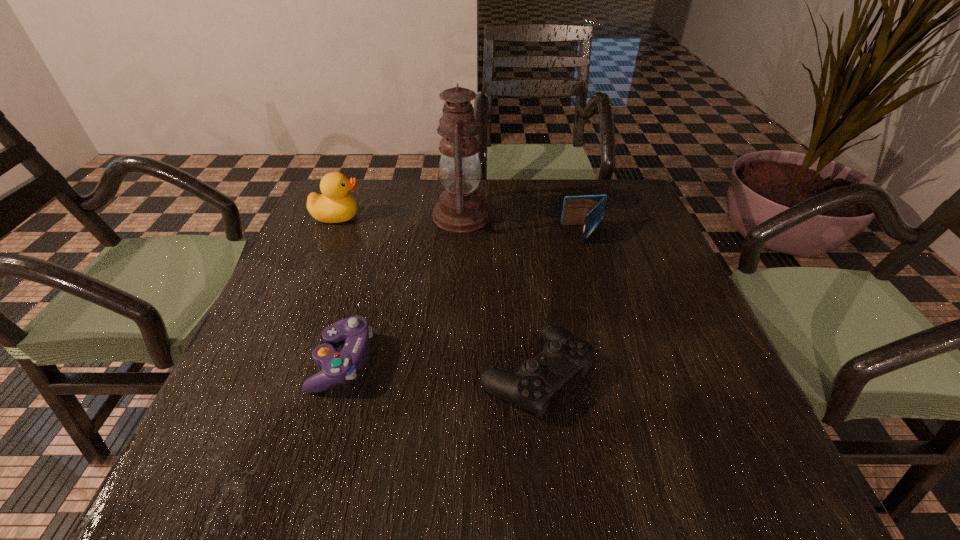
Where is `vacant area between the right control and the second object from left to right`? Image resolution: width=960 pixels, height=540 pixels. vacant area between the right control and the second object from left to right is located at coordinates (439, 367).

The width and height of the screenshot is (960, 540). What are the coordinates of `empty space between the oil lamp and the right control` in the screenshot? It's located at (498, 295).

Where is `free space between the second object from left to right and the tallest object`? free space between the second object from left to right and the tallest object is located at coordinates (402, 288).

Identify the location of free space between the third tallest object and the right control. (559, 304).

Locate an element on the screen. The width and height of the screenshot is (960, 540). vacant space in between the left control and the tallest object is located at coordinates (402, 288).

You are a GUI agent. You are given a task and a screenshot of the screen. Output one action in this format:
    pyautogui.click(x=<x>, y=<y>)
    Task: Click on the free space between the duck and the right control
    The height and width of the screenshot is (540, 960).
    Given the screenshot: What is the action you would take?
    pyautogui.click(x=436, y=295)

The width and height of the screenshot is (960, 540). Identify the location of free space between the tallest object and the fourth object from right to left. (402, 288).

The height and width of the screenshot is (540, 960). Find the location of `free space between the fourth object from right to left and the third shortest object`. free space between the fourth object from right to left and the third shortest object is located at coordinates pos(464,298).

Where is `object that is the third nearest to the tallest object`? The width and height of the screenshot is (960, 540). object that is the third nearest to the tallest object is located at coordinates (563, 356).

Locate which object ranks in proximity to the leftmost object. Please provide its 2D coordinates. Your answer should be formatted as a tuple, i.e. [(x, y)], where the tuple contains the x and y coordinates of a point satisfying the conditions above.

[(461, 208)]